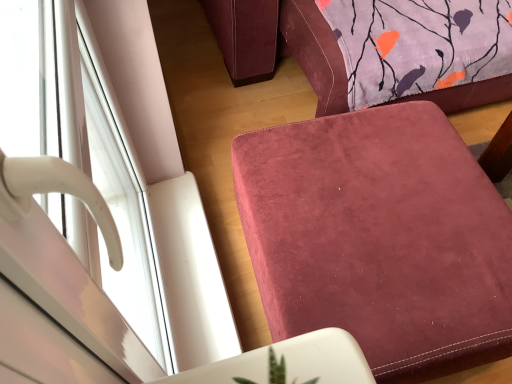
Where is `free space above suede-like burgundy ottoman at lower right (from a real-world perspective)`? free space above suede-like burgundy ottoman at lower right (from a real-world perspective) is located at coordinates click(x=377, y=219).